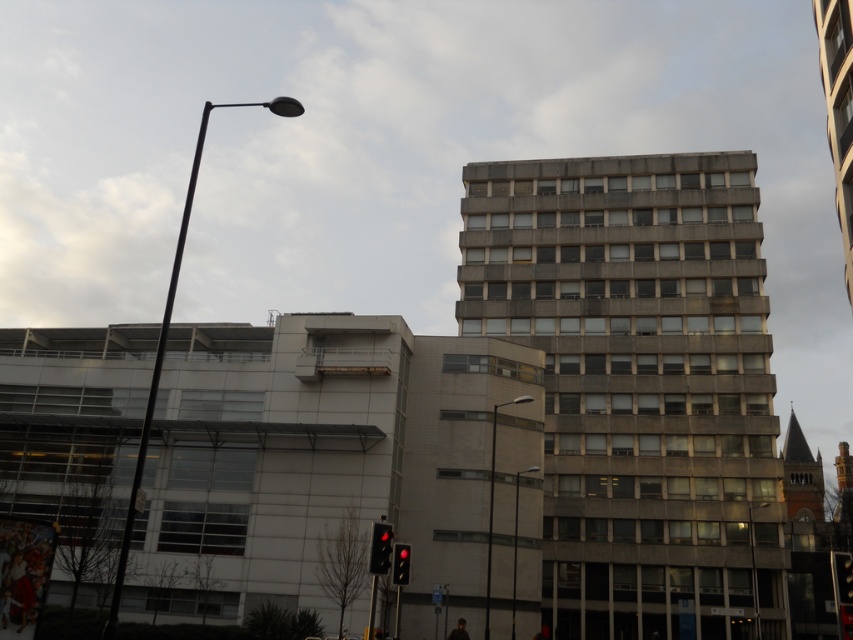
In the scene shown: You are standing at the origin point of the coordinate system in the urban scene. The concrete building at center is located at point 0.600, 0.749. If you want to walk directly towards it, which direction should you head?

The concrete building at center is located at point (637, 384), so you should head in the direction of increasing x and y coordinates to reach it.

From the picture: You are a city planner assessing the urban layout. You need to determine if the concrete building at center will block the view of the red glass traffic light at lower center from the street level. Based on their heights, can you confirm if the traffic light is visible?

The concrete building at center is taller than the red glass traffic light at lower center. Since the building is taller, it could potentially block the view of the traffic light from street level depending on their exact positions and angles, but based solely on height, the traffic light might be obscured if the building is directly in front.